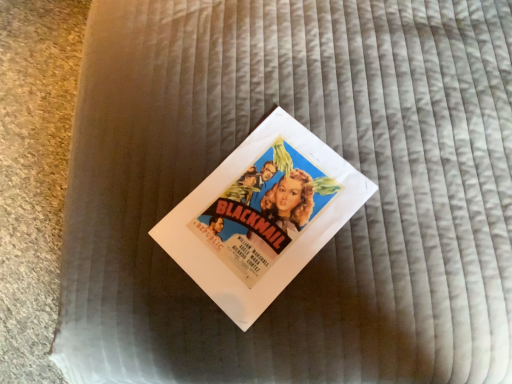
The image size is (512, 384). Identify the location of free space above matte paper poster at center (from a real-world perspective). (247, 220).